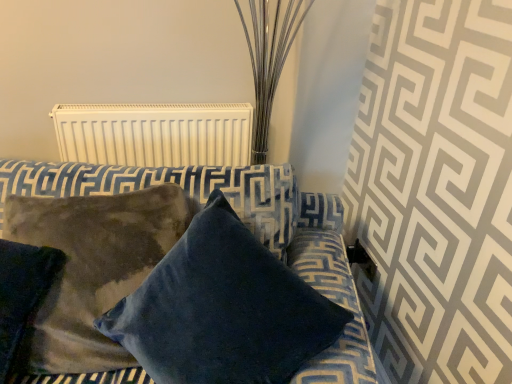
Question: Is white matte radiator at upper center taller or shorter than velvet blue pillow at center, arranged as the first pillow when viewed from the right?

Choices:
 (A) short
 (B) tall

Answer: (A)

Question: Would you say white matte radiator at upper center is to the left or to the right of velvet blue pillow at center, which ranks as the 2th pillow in left-to-right order, in the picture?

Choices:
 (A) left
 (B) right

Answer: (A)

Question: Which object is positioned farthest from the suede-like brown pillow at lower left, placed as the first pillow when sorted from left to right?

Choices:
 (A) velvet blue pillow at center, arranged as the first pillow when viewed from the right
 (B) white matte radiator at upper center

Answer: (B)

Question: Which of these objects is positioned farthest from the velvet blue pillow at center, which ranks as the 2th pillow in left-to-right order?

Choices:
 (A) white matte radiator at upper center
 (B) suede-like brown pillow at lower left, placed as the first pillow when sorted from left to right

Answer: (A)